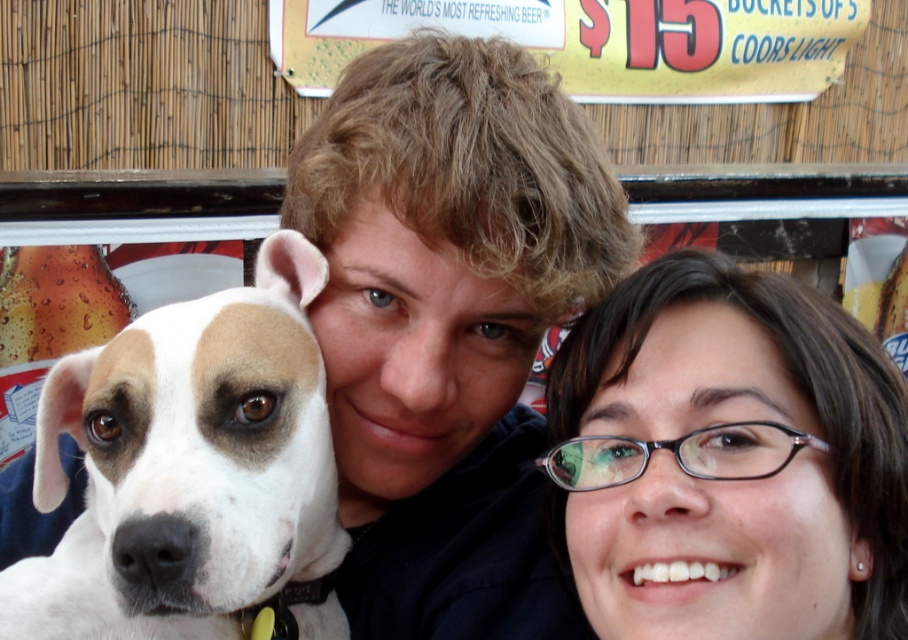
Is matte black shirt at center thinner than matte black glasses at upper right?

No, matte black shirt at center is not thinner than matte black glasses at upper right.

Is matte black shirt at center smaller than matte black glasses at upper right?

No.

Image resolution: width=908 pixels, height=640 pixels. In order to click on matte black shirt at center in this screenshot , I will do `click(449, 324)`.

Image resolution: width=908 pixels, height=640 pixels. Find the location of `matte black shirt at center`. matte black shirt at center is located at coordinates click(x=449, y=324).

Who is more forward, (x=52, y=540) or (x=224, y=467)?

Point (x=224, y=467) is in front.

Is matte black shirt at center to the left of white fur at left from the viewer's perspective?

No, matte black shirt at center is not to the left of white fur at left.

Between point (521, 156) and point (35, 474), which one is positioned behind?

The point (35, 474) is more distant.

Find the location of a particular element. This screenshot has height=640, width=908. matte black shirt at center is located at coordinates (449, 324).

Who is shorter, matte black glasses at upper right or white fur at left?

matte black glasses at upper right

Is matte black glasses at upper right above white fur at left?

Yes, matte black glasses at upper right is above white fur at left.

Is point (728, 600) closer to camera compared to point (250, 588)?

Yes, point (728, 600) is closer to viewer.

At what (x,y) coordinates should I click in order to perform the action: click on matte black glasses at upper right. Please return your answer as a coordinate pair (x, y). Looking at the image, I should click on (729, 460).